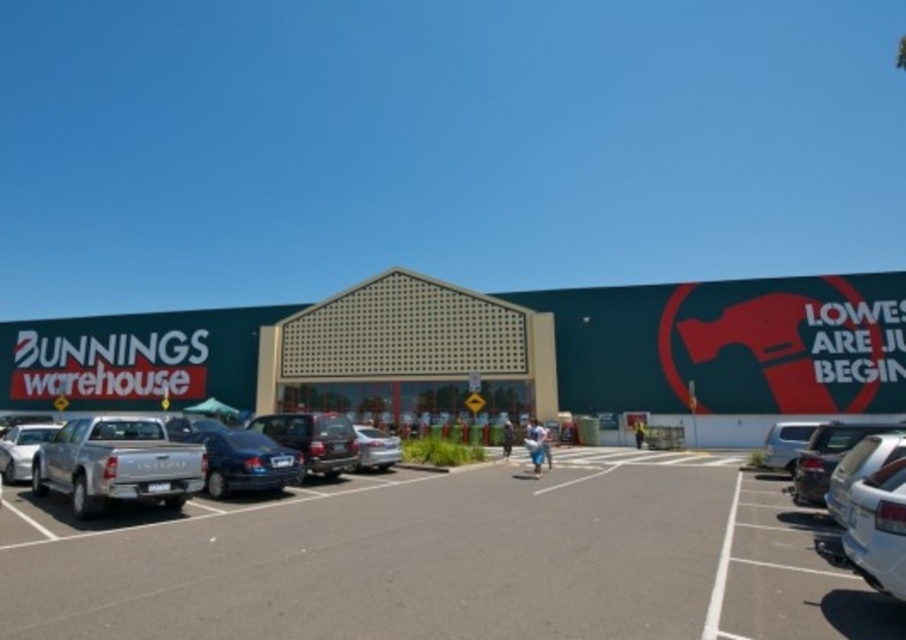
You are standing at the entrance of the Bunnings Warehouse store. You need to locate the metallic gray suv at center. According to the coordinates provided, where would you find it?

The metallic gray suv at center is located at coordinates point (x=313, y=440), which is at the center of the image.

You are a delivery driver approaching the Bunnings Warehouse. You need to park your truck in the parking lot near the entrance. Given the height of the green matte building at center and the silver metallic truck at left, will the truck fit under the triangular roofline of the building?

The green matte building at center is taller than the silver metallic truck at left. Since the building has a triangular roofline, the truck should be able to pass under it as long as the truck is shorter than the building. However, the exact clearance isn